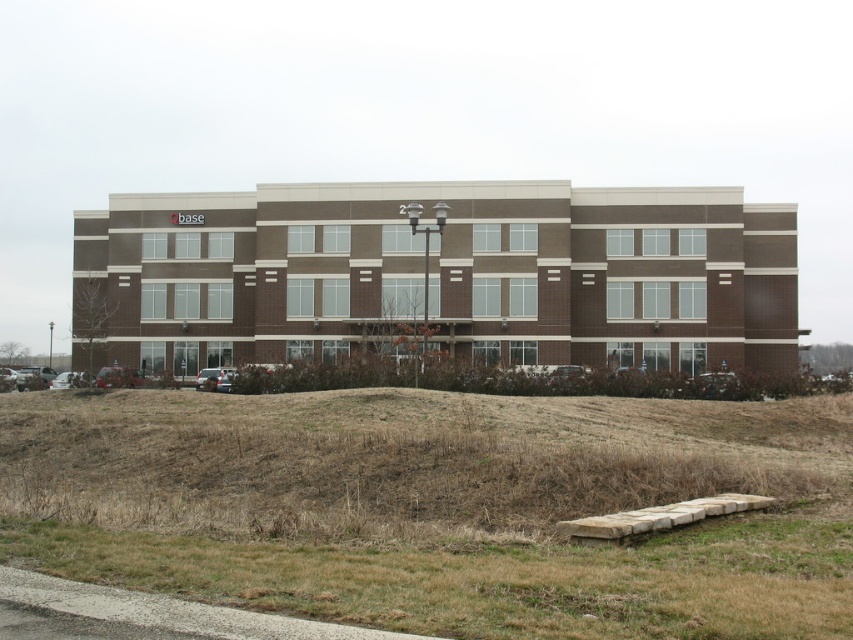
Does point (86, 461) lie in front of point (775, 637)?

No, (86, 461) is behind (775, 637).

Can you confirm if brown dry grass at lower center is positioned to the left of dry grass at lower center?

Correct, you'll find brown dry grass at lower center to the left of dry grass at lower center.

The height and width of the screenshot is (640, 853). Find the location of `brown dry grass at lower center`. brown dry grass at lower center is located at coordinates (438, 508).

At what (x,y) coordinates should I click in order to perform the action: click on brown dry grass at lower center. Please return your answer as a coordinate pair (x, y). Image resolution: width=853 pixels, height=640 pixels. Looking at the image, I should click on [438, 508].